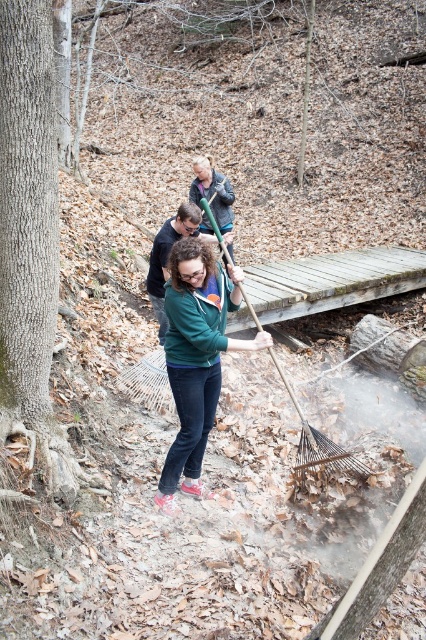
Can you confirm if matte green sweater at center is positioned above dark blue jacket at upper center?

No.

Looking at this image, who is higher up, matte green sweater at center or dark blue jacket at upper center?

dark blue jacket at upper center is higher up.

The width and height of the screenshot is (426, 640). Describe the element at coordinates (195, 356) in the screenshot. I see `matte green sweater at center` at that location.

This screenshot has height=640, width=426. What are the coordinates of `matte green sweater at center` in the screenshot? It's located at (195, 356).

Does matte green sweater at center have a lesser width compared to dark blue jeans at center?

In fact, matte green sweater at center might be wider than dark blue jeans at center.

Is matte green sweater at center positioned in front of dark blue jeans at center?

Yes, it is in front of dark blue jeans at center.

Who is more distant from viewer, (189,323) or (161,244)?

The point (161,244) is behind.

The height and width of the screenshot is (640, 426). Identify the location of matte green sweater at center. (195, 356).

Does wooden rake at center appear on the right side of dark blue jacket at upper center?

Yes, wooden rake at center is to the right of dark blue jacket at upper center.

Which is more to the right, wooden rake at center or dark blue jacket at upper center?

wooden rake at center is more to the right.

Which is in front, point (336, 451) or point (190, 195)?

Point (336, 451) is in front.

Where is `wooden rake at center`? wooden rake at center is located at coordinates (319, 444).